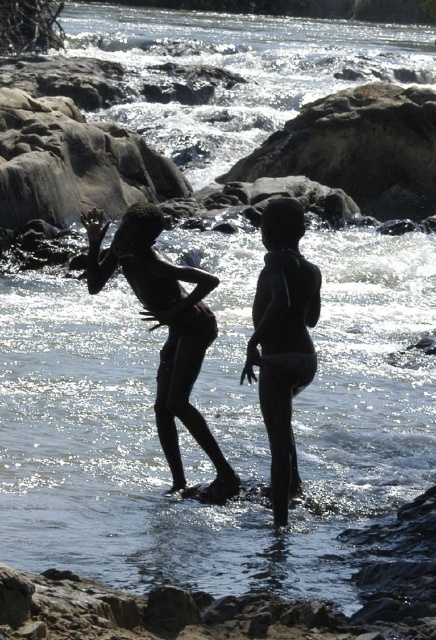
Who is shorter, black matte skin at center or black matte swimsuit at center?

black matte skin at center is shorter.

Does black matte skin at center have a larger size compared to black matte swimsuit at center?

Indeed, black matte skin at center has a larger size compared to black matte swimsuit at center.

Between point (207, 440) and point (286, 392), which one is positioned behind?

Positioned behind is point (207, 440).

Locate an element on the screen. The height and width of the screenshot is (640, 436). black matte skin at center is located at coordinates (169, 330).